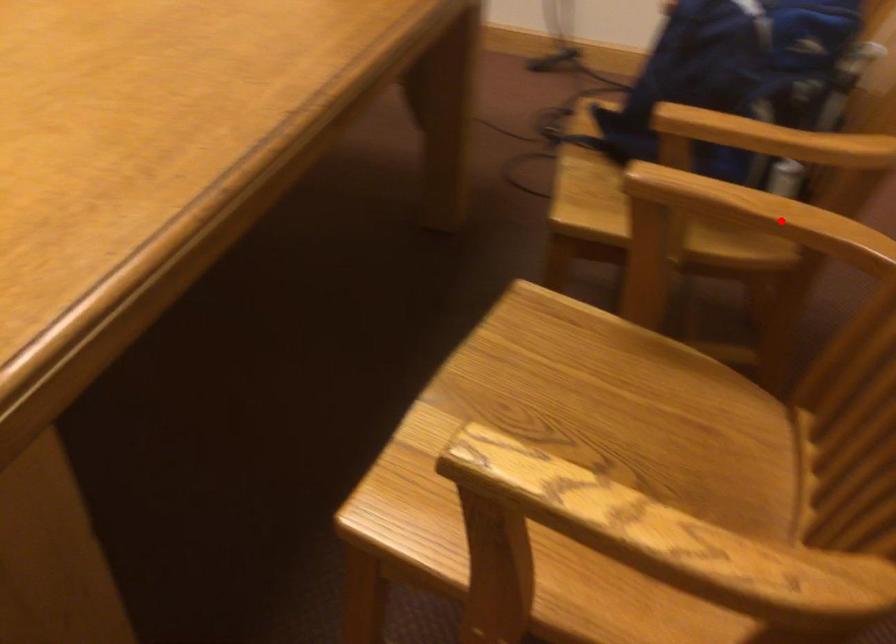
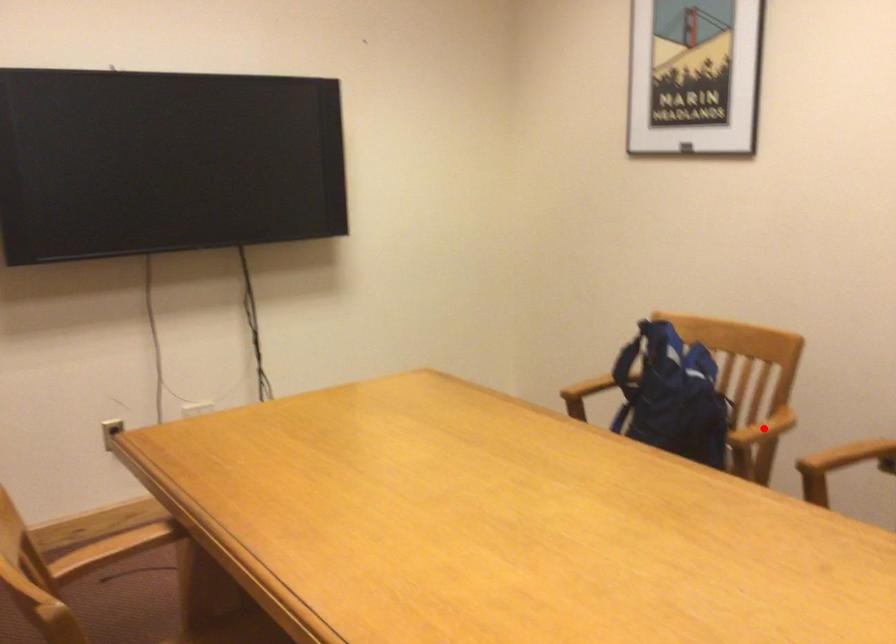
I am providing you with two images of the same scene from different viewpoints. A red point is marked on the first image and another point is marked on the second image. Are the points marked in image1 and image2 representing the same 3D position?

No